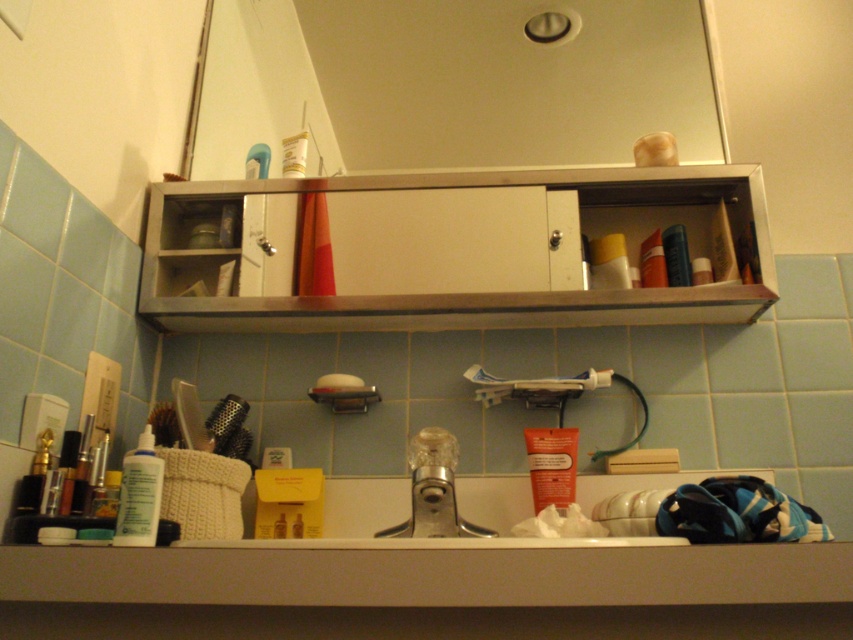
Question: Based on their relative distances, which object is nearer to the yellow matte tube at upper center?

Choices:
 (A) white matte toothpaste at center
 (B) white matte tube at upper center
 (C) metallic mirror at upper center
 (D) white matte soap at center

Answer: (A)

Question: Can you confirm if metallic cabinet at center is positioned above white matte soap at center?

Choices:
 (A) no
 (B) yes

Answer: (B)

Question: Which point is farther from the camera taking this photo?

Choices:
 (A) (477, 400)
 (B) (360, 387)

Answer: (A)

Question: Which object is the closest to the white matte toothpaste at center?

Choices:
 (A) white matte lotion at left
 (B) white matte soap at center
 (C) matte plastic bottle at upper right

Answer: (C)

Question: Is white matte lotion at left closer to the viewer compared to matte orange tube at center?

Choices:
 (A) no
 (B) yes

Answer: (B)

Question: Is white matte toothpaste at center further to the viewer compared to white matte tube at upper center?

Choices:
 (A) no
 (B) yes

Answer: (A)